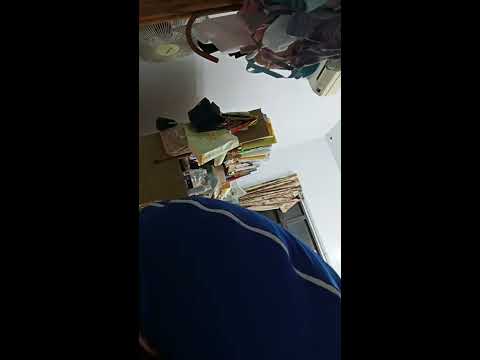
Identify the location of curtain. (269, 202).